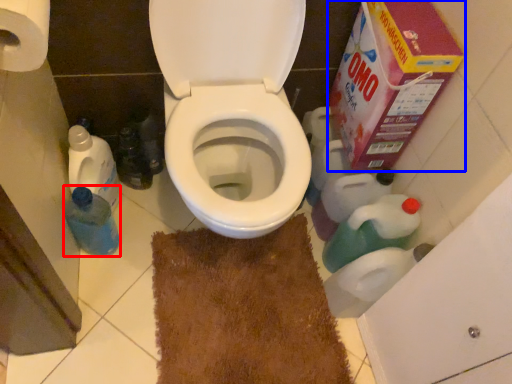
Question: Among these objects, which one is farthest to the camera, bottle (highlighted by a red box) or cardboard box (highlighted by a blue box)?

Choices:
 (A) bottle
 (B) cardboard box

Answer: (A)